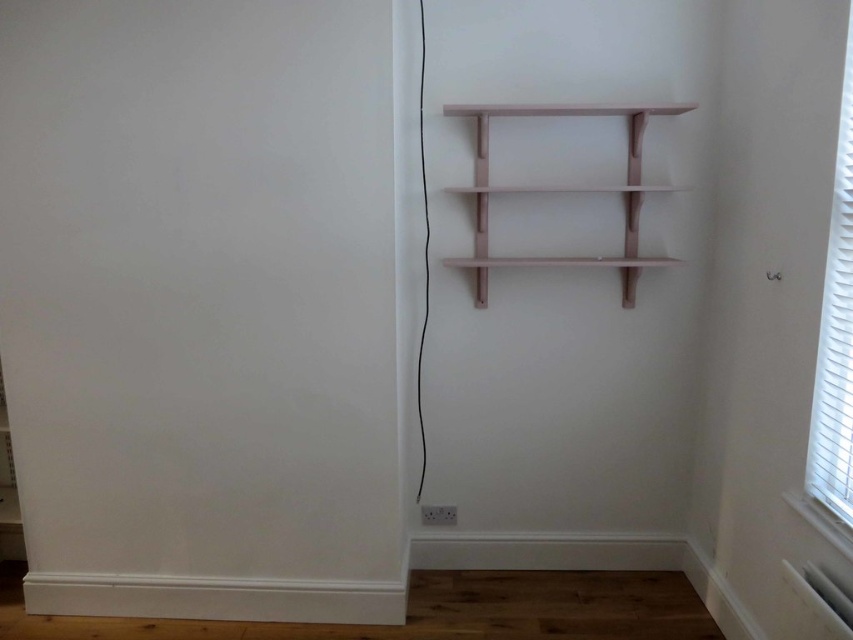
Is point (840, 132) behind point (657, 109)?

No, (840, 132) is closer to viewer.

From the picture: Does white textured blinds at right have a smaller size compared to matte pink shelf at upper center?

Yes.

Locate an element on the screen. white textured blinds at right is located at coordinates (834, 333).